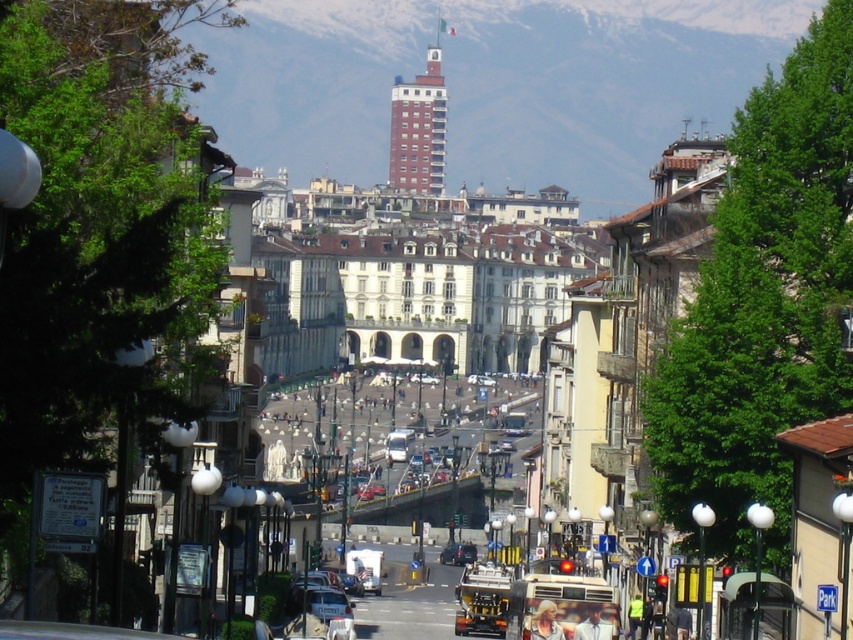
You are a drone operator tasked with capturing aerial footage of the red brick tower at upper center. According to the coordinates provided, where should you position the drone relative to the image frame?

The red brick tower at upper center is located at point (418, 129), meaning the drone should position itself at those coordinates to capture the tower effectively.

You are a drone operator trying to capture a photo of the red brick tower at upper center and the light brown hair at center from above. Which object should you focus on first if you want to ensure both are in frame without moving the camera?

The red brick tower at upper center is bigger than the light brown hair at center, so you should focus on the red brick tower at upper center first to ensure both are in frame without moving the camera.